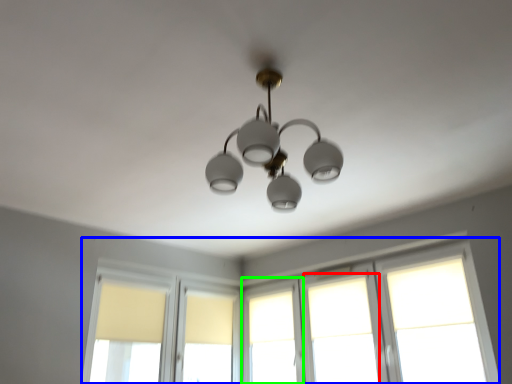
Question: Considering the real-world distances, which object is farthest from window (highlighted by a red box)? window (highlighted by a blue box) or window (highlighted by a green box)?

Choices:
 (A) window
 (B) window

Answer: (B)